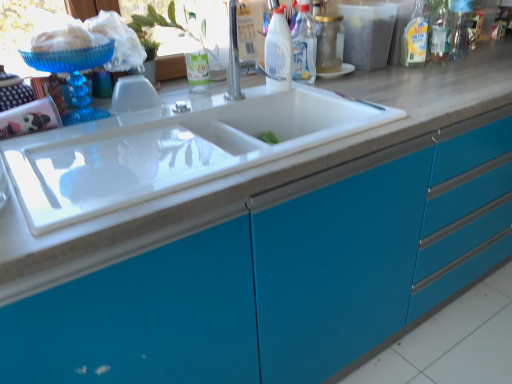
Question: Relative to white glossy bottle at upper center, positioned as the first bottle in left-to-right order, is silver metallic faucet at upper center in front or behind?

Choices:
 (A) front
 (B) behind

Answer: (A)

Question: Is silver metallic faucet at upper center bigger or smaller than white glossy bottle at upper center, positioned as the first bottle in left-to-right order?

Choices:
 (A) big
 (B) small

Answer: (A)

Question: Which object is the farthest from the white glossy bottle at upper center, arranged as the third bottle when viewed from the right?

Choices:
 (A) silver metallic faucet at upper center
 (B) transparent plastic window screen at upper center
 (C) clear plastic bottle at upper right, acting as the fourth bottle starting from the left
 (D) blue glossy cabinet at center
 (E) white glossy bottle at upper center, positioned as the first bottle in left-to-right order

Answer: (C)

Question: Which object is the closest to the silver metallic faucet at upper center?

Choices:
 (A) white glossy bottle at upper center, arranged as the third bottle when viewed from the right
 (B) transparent plastic window screen at upper center
 (C) blue glossy cabinet at center
 (D) white glossy bottle at upper center, positioned as the first bottle in left-to-right order
 (E) transparent glass jar at upper center, marked as the second bottle in a right-to-left arrangement

Answer: (D)